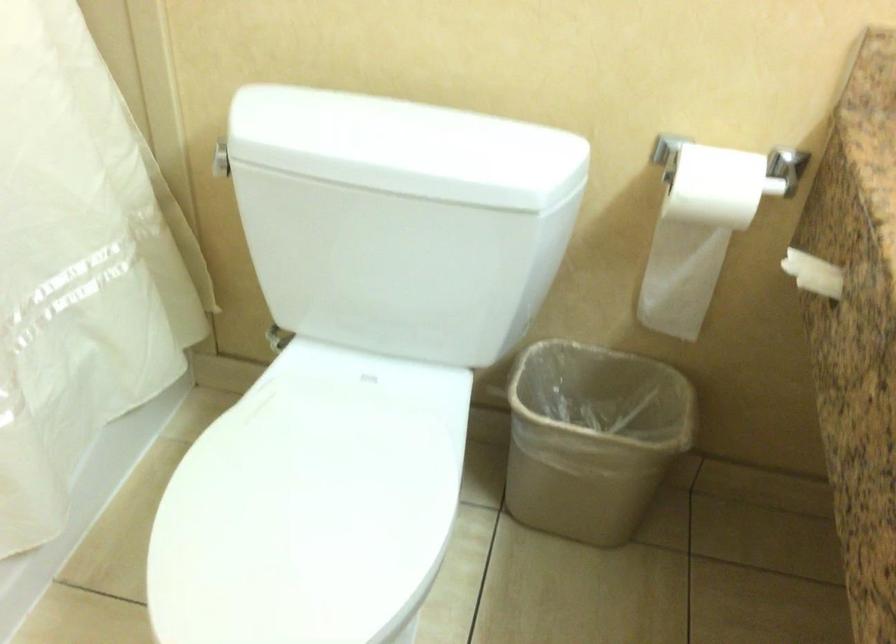
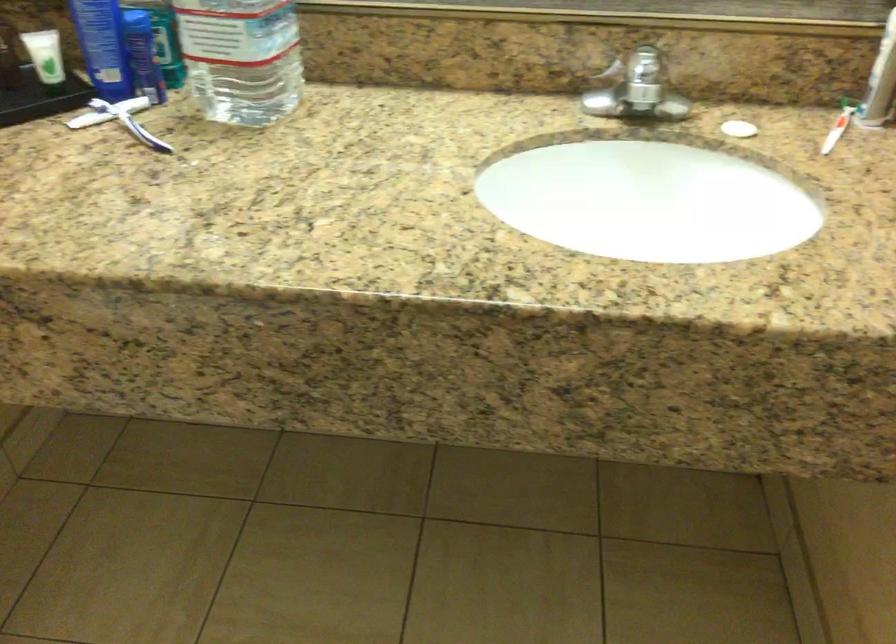
The images are taken continuously from a first-person perspective. In which direction is your viewpoint rotating?

The camera rotated toward right-down.